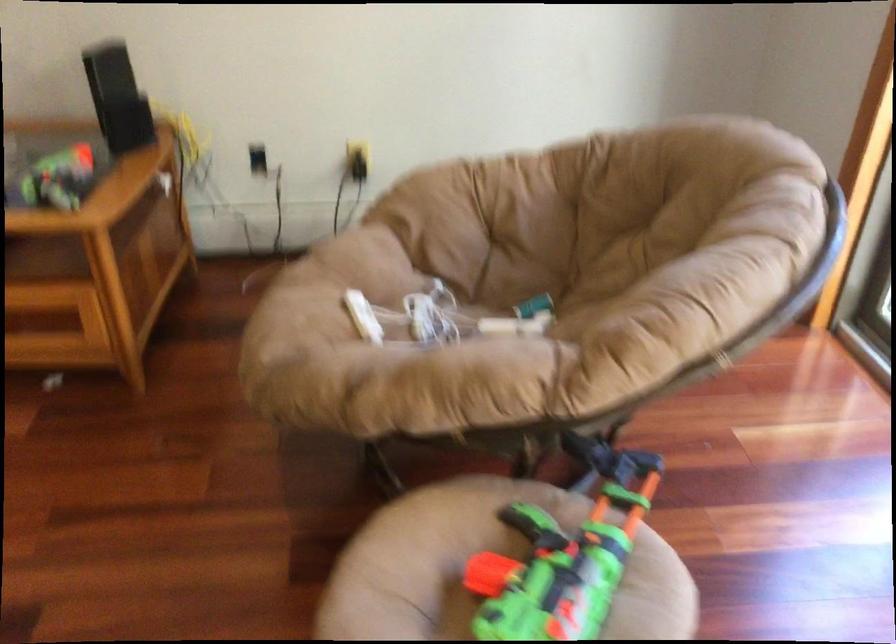
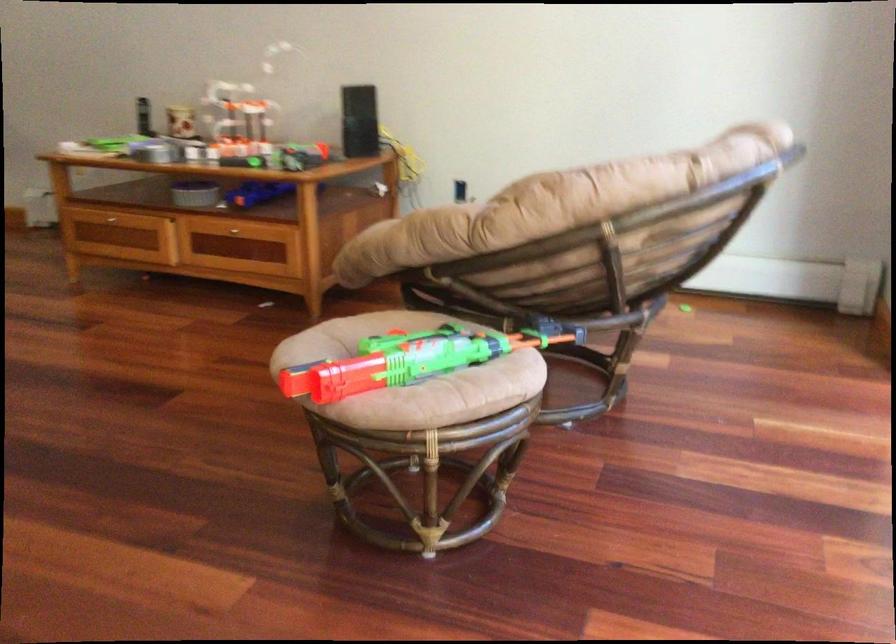
Question: The images are taken continuously from a first-person perspective. In which direction are you moving?

Choices:
 (A) Left
 (B) Right
 (C) Forward
 (D) Backward

Answer: (B)